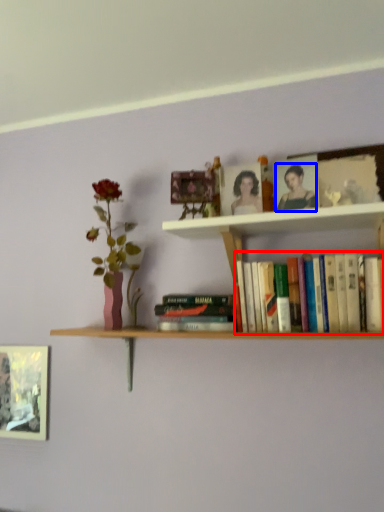
Question: Which point is closer to the camera, book (highlighted by a red box) or person (highlighted by a blue box)?

Choices:
 (A) book
 (B) person

Answer: (A)